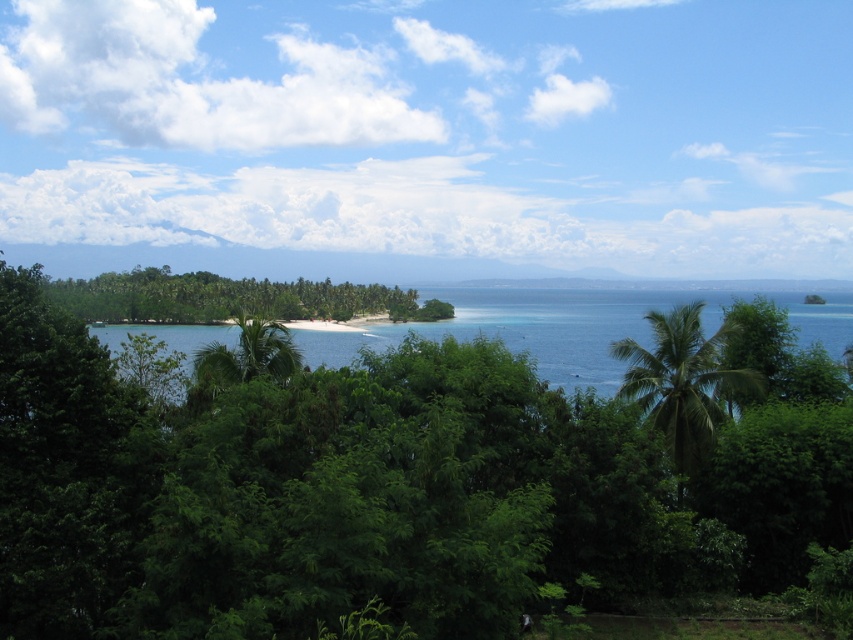
Is green leafy island at center to the right of green leafy palm tree at center-right from the viewer's perspective?

In fact, green leafy island at center is to the left of green leafy palm tree at center-right.

Who is more distant from viewer, (247,314) or (675,369)?

The point (675,369) is more distant.

The height and width of the screenshot is (640, 853). I want to click on green leafy island at center, so click(x=229, y=298).

What do you see at coordinates (384, 486) in the screenshot? I see `green leafy tree at center` at bounding box center [384, 486].

I want to click on green leafy tree at center, so click(384, 486).

Between green leafy tree at center and green leafy island at center, which one has less height?

Standing shorter between the two is green leafy tree at center.

Consider the image. Is green leafy tree at center wider than green leafy island at center?

No.

Which is behind, point (440, 548) or point (254, 296)?

Point (254, 296)

The width and height of the screenshot is (853, 640). What are the coordinates of `green leafy tree at center` in the screenshot? It's located at (384, 486).